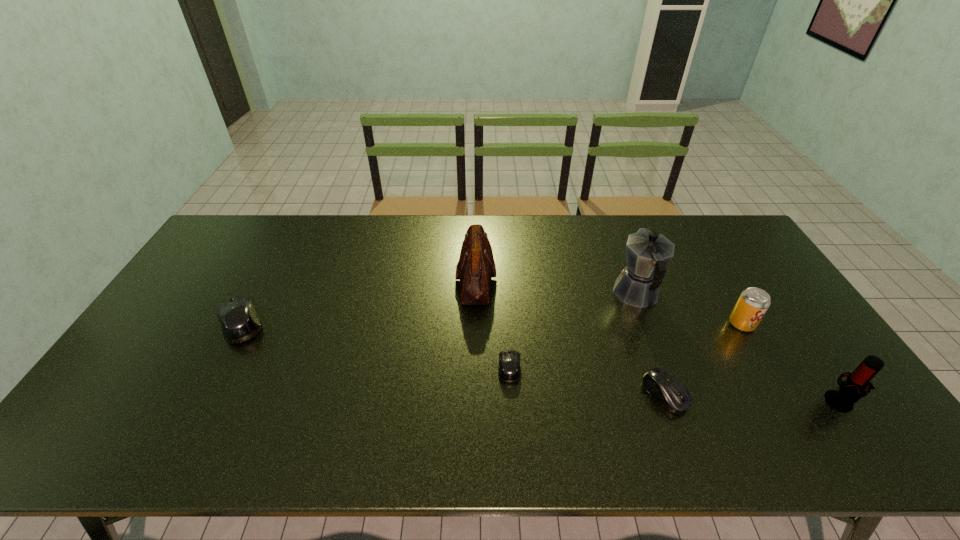
I want to click on the fifth shortest object, so click(850, 391).

Locate an element on the screen. The height and width of the screenshot is (540, 960). microphone is located at coordinates (850, 391).

I want to click on free region located 0.270m on the right of the leftmost mouse, so click(358, 323).

The height and width of the screenshot is (540, 960). Identify the location of free spot located on the back of the shortest mouse. 507,323.

You are a GUI agent. You are given a task and a screenshot of the screen. Output one action in this format:
    pyautogui.click(x=<x>, y=<y>)
    Task: Click on the vacant space situated 0.380m on the left of the second shortest object
    The height and width of the screenshot is (540, 960).
    Given the screenshot: What is the action you would take?
    pyautogui.click(x=492, y=394)

Identify the location of free spot located on the left of the sixth object from left to right. (663, 323).

At what (x,y) coordinates should I click in order to perform the action: click on free space located 0.240m at the spout of the coffeepot. Please return your answer as a coordinate pair (x, y). Looking at the image, I should click on (612, 230).

Locate an element on the screen. This screenshot has width=960, height=540. free space located at the spout of the coffeepot is located at coordinates (613, 231).

Identify the location of free space located 0.080m at the spout of the coffeepot. Image resolution: width=960 pixels, height=540 pixels. (623, 257).

What are the coordinates of `vacant space located on the left of the second tallest object` in the screenshot? It's located at (434, 279).